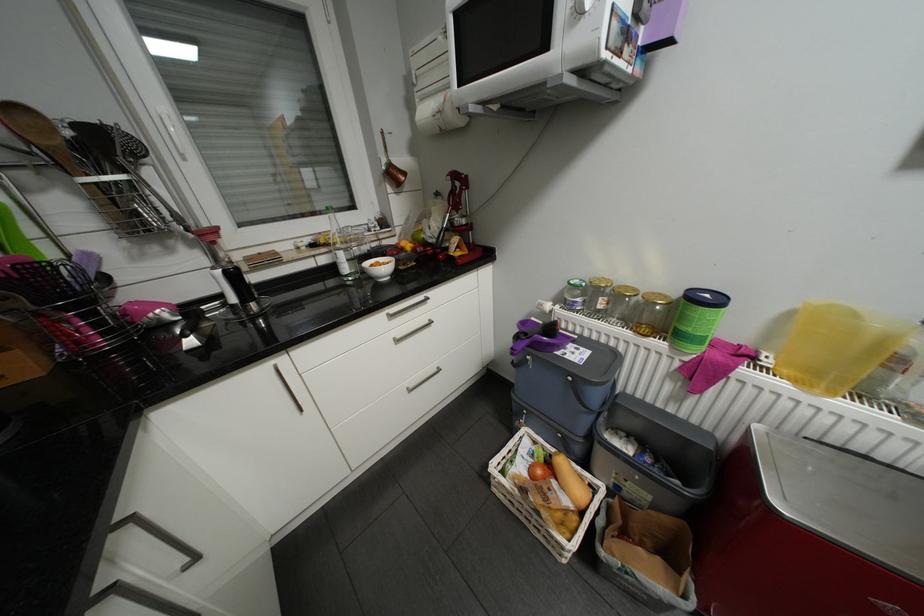
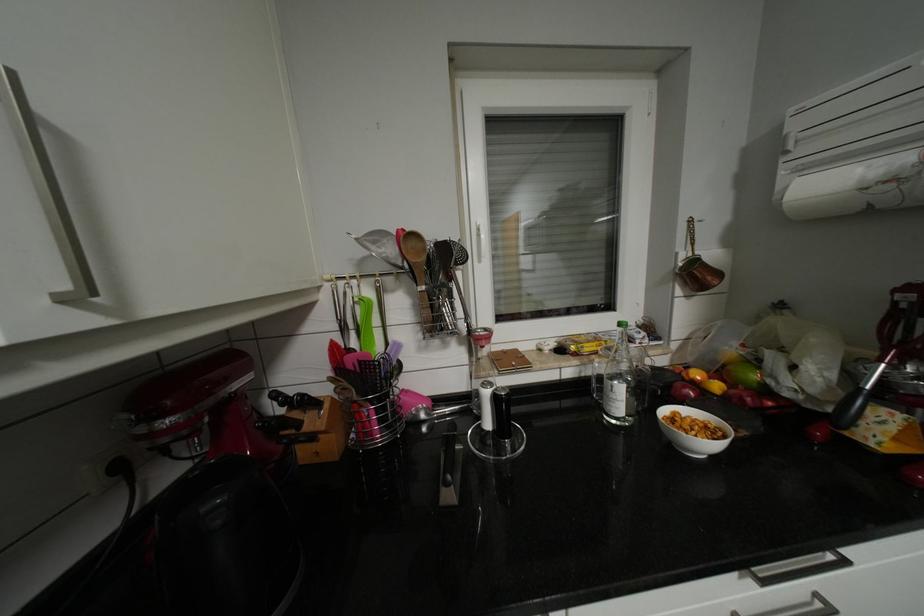
In the second image, find the point that corresponds to point (391, 267) in the first image.

(703, 430)